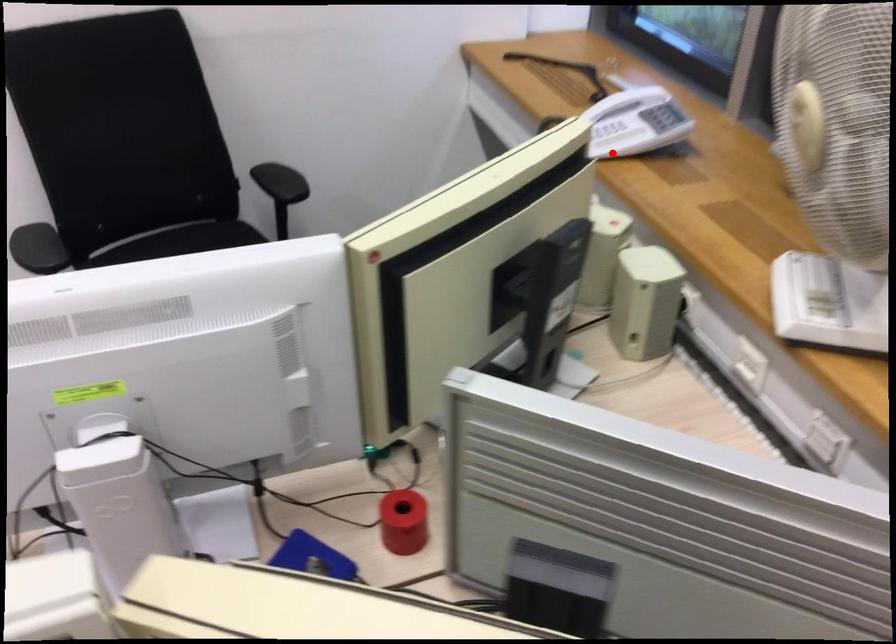
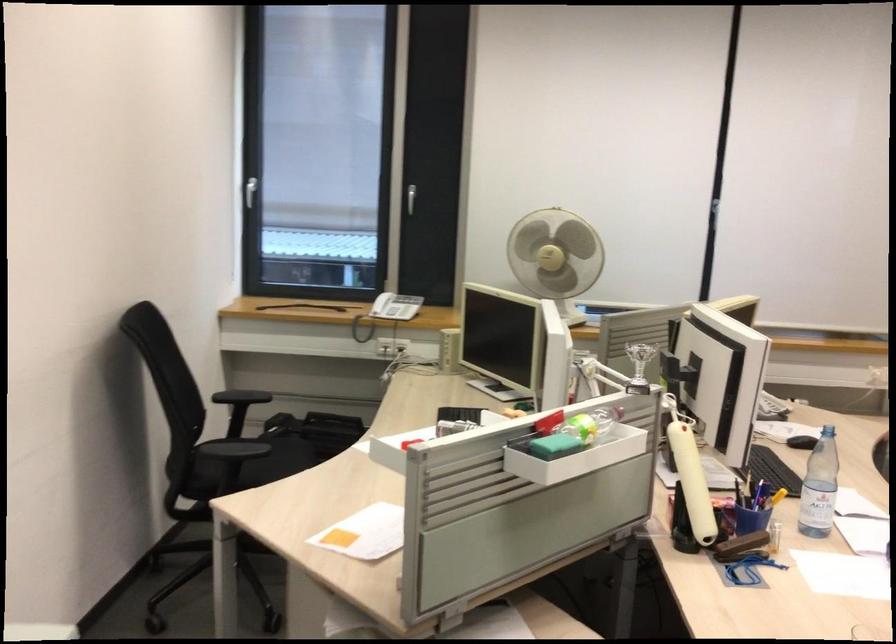
In the second image, find the point that corresponds to the highlighted location in the first image.

(386, 312)